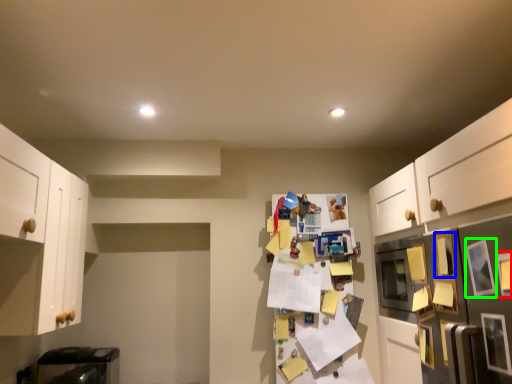
Question: Considering the real-world distances, which object is farthest from picture frame (highlighted by a red box)? picture frame (highlighted by a blue box) or picture frame (highlighted by a green box)?

Choices:
 (A) picture frame
 (B) picture frame

Answer: (A)